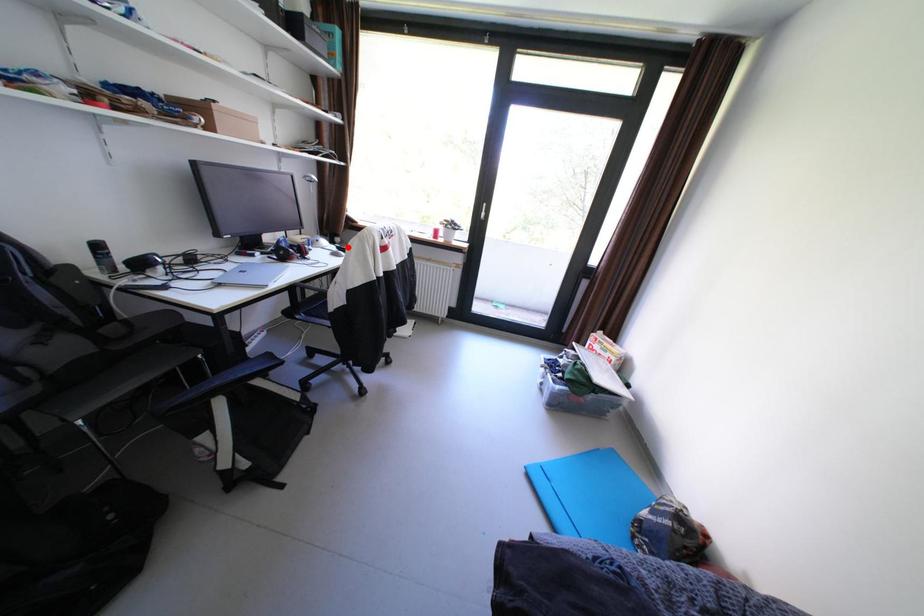
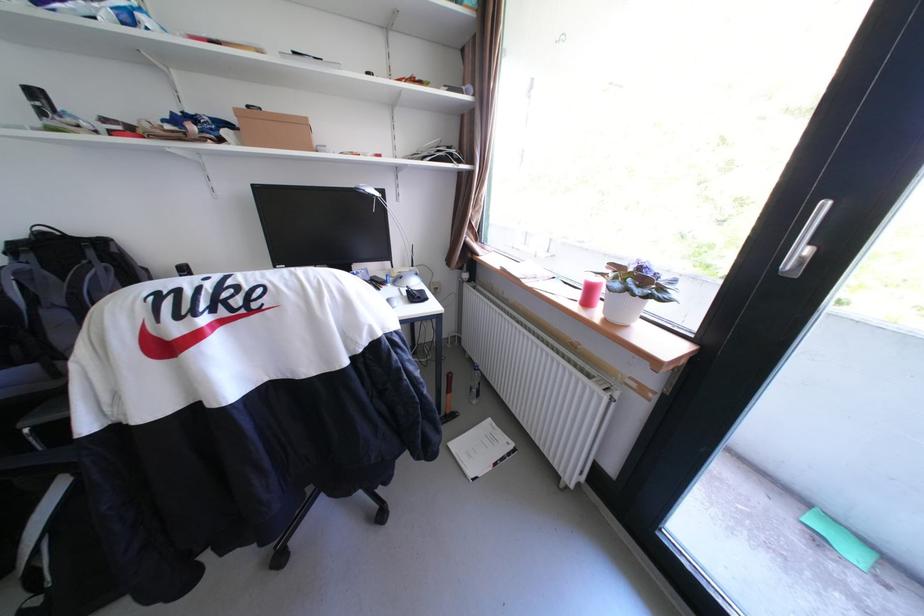
The point at the highlighted location is marked in the first image. Where is the corresponding point in the second image?

(418, 291)